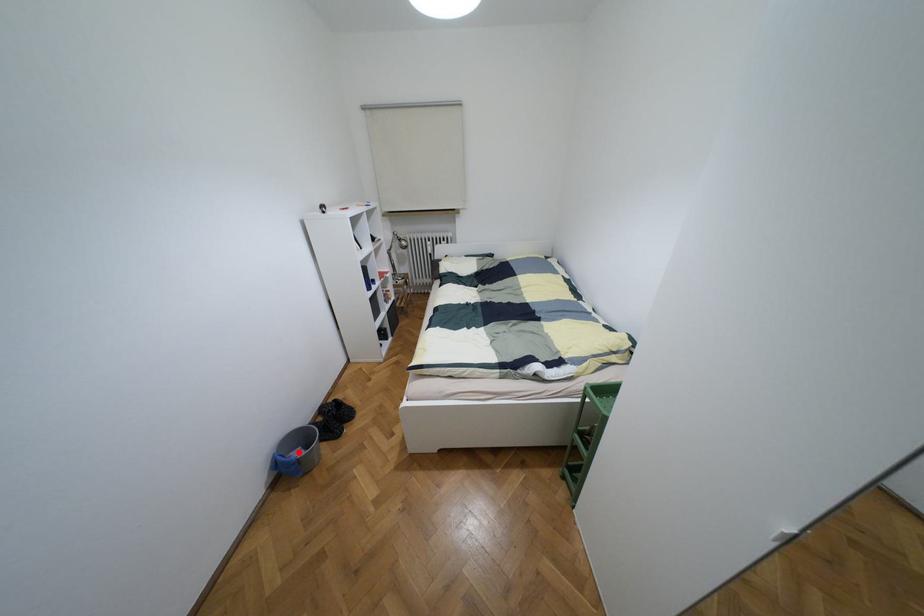
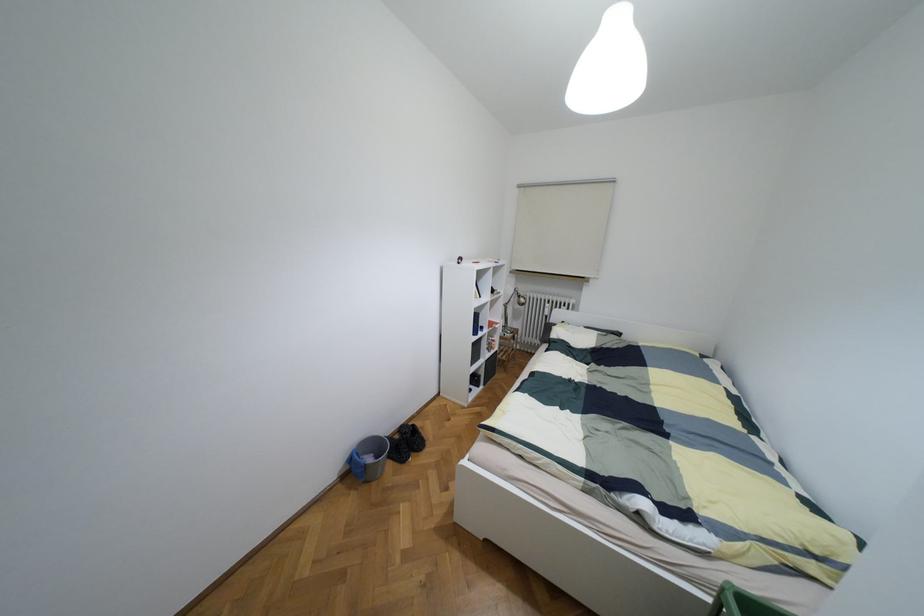
Question: I am providing you with two images of the same scene from different viewpoints. In image1, a red point is highlighted. Considering the same 3D point in image2, which of the following is correct?

Choices:
 (A) It is closer
 (B) It is farther

Answer: (B)